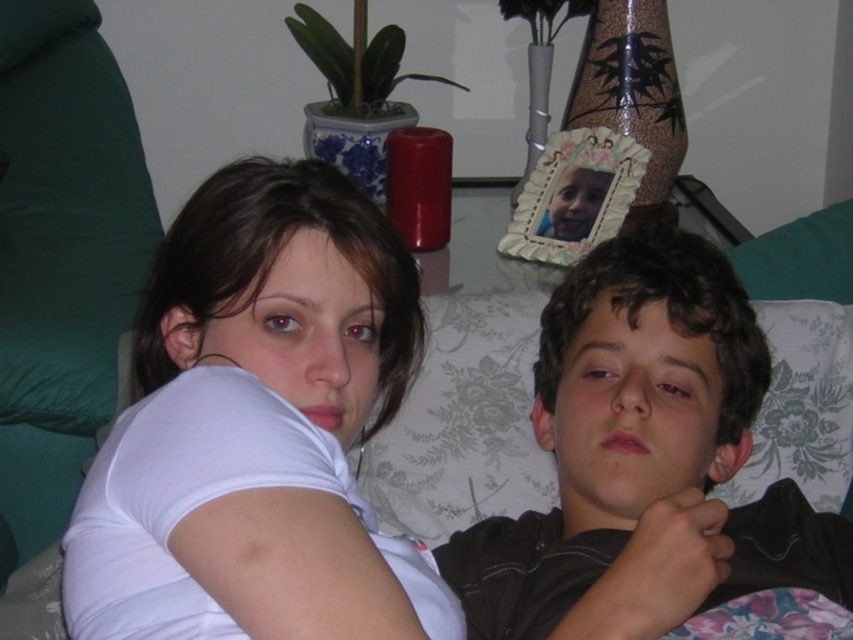
In the scene shown: You are a photographer setting up for a group photo. You notice the white matte shirt at upper left and the dark brown curly hair at center in your frame. Which object is closer to the camera?

The white matte shirt at upper left is in front of the dark brown curly hair at center, so it is closer to the camera.

You are a photographer setting up a shoot. You need to place a narrow accessory between the white matte shirt at upper left and the dark brown curly hair at center. Will the accessory fit between them?

The white matte shirt at upper left is thinner than the dark brown curly hair at center, so the accessory can fit between them as there is enough space.